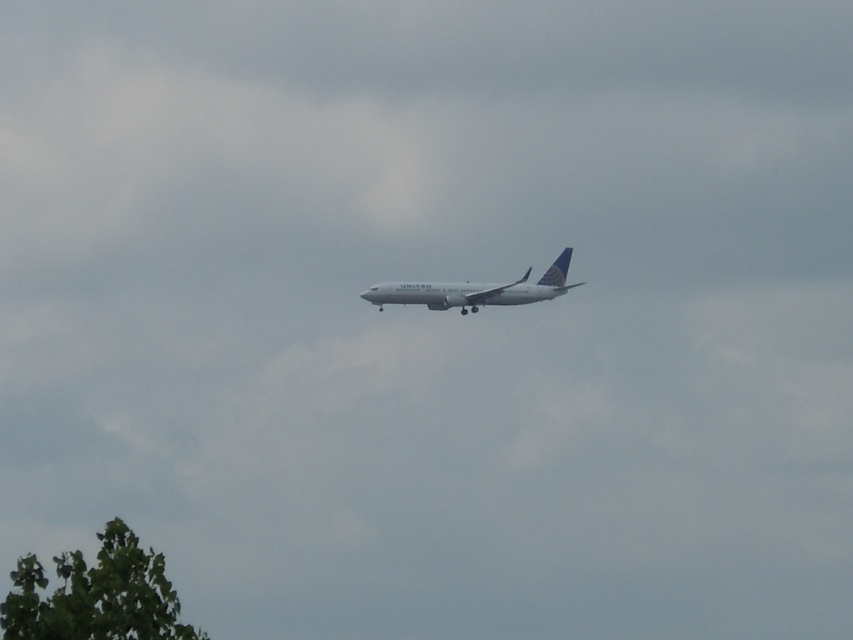
Does point (172, 628) come behind point (418, 289)?

No, (172, 628) is in front of (418, 289).

Between green leafy tree at lower left and white matte airplane at center, which one appears on the right side from the viewer's perspective?

white matte airplane at center is more to the right.

Who is more forward, (80, 563) or (483, 285)?

Point (80, 563) is in front.

Locate an element on the screen. The image size is (853, 640). green leafy tree at lower left is located at coordinates (96, 595).